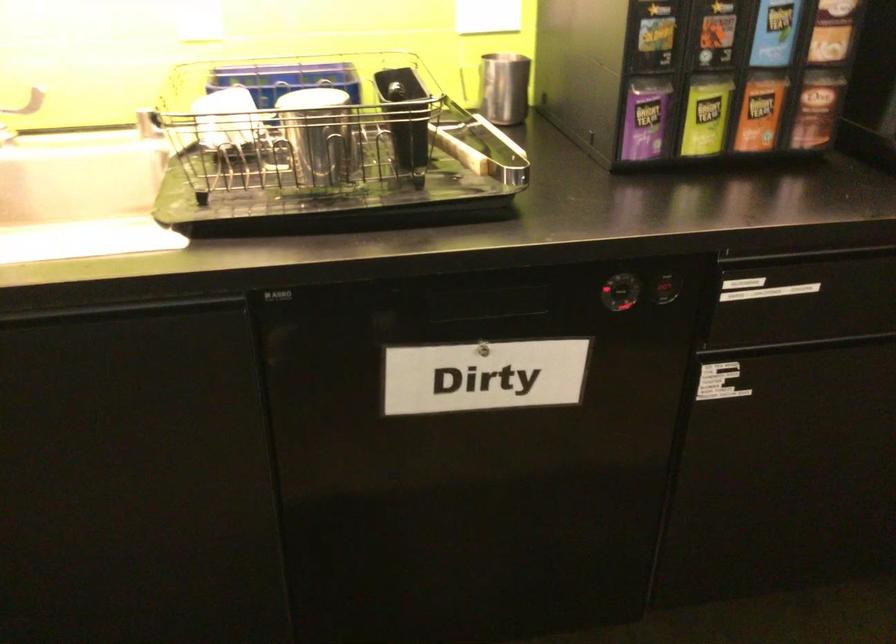
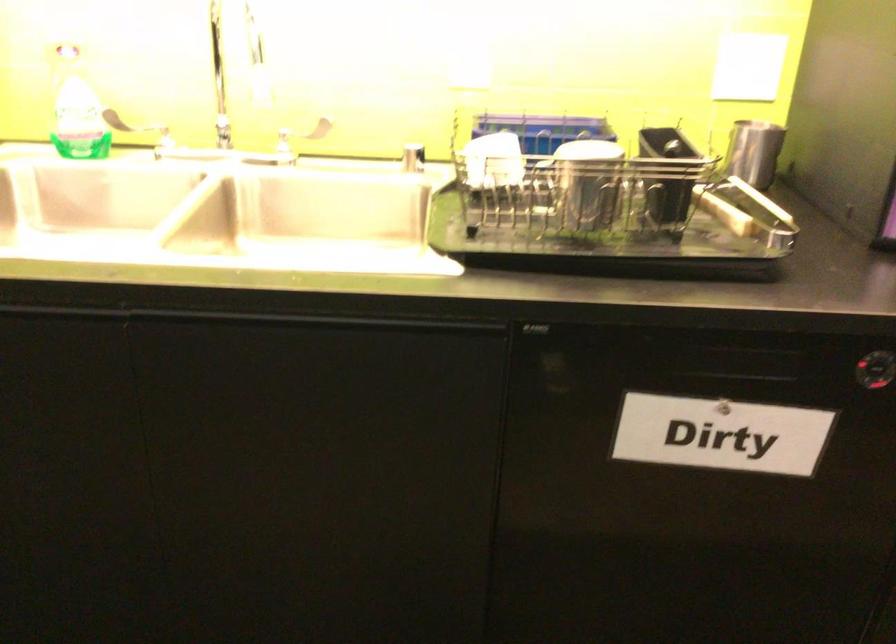
Question: The images are taken continuously from a first-person perspective. In which direction is your viewpoint rotating?

Choices:
 (A) Left
 (B) Right
 (C) Up
 (D) Down

Answer: (A)